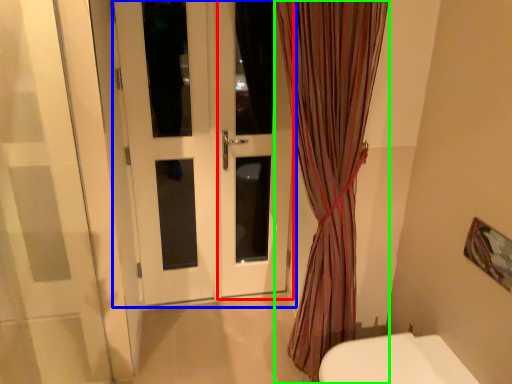
Question: Based on their relative distances, which object is farther from screen door (highlighted by a red box)? Choose from door (highlighted by a blue box) and curtain (highlighted by a green box).

Choices:
 (A) door
 (B) curtain

Answer: (B)